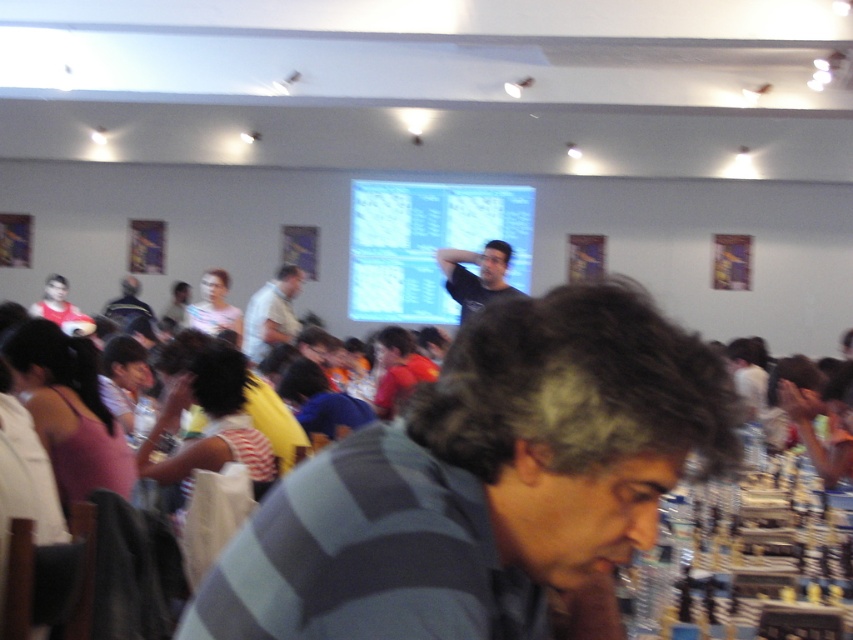
Measure the distance from gray striped shirt at center to light gray shirt at center.

The distance of gray striped shirt at center from light gray shirt at center is 20.62 feet.

Does gray striped shirt at center come in front of light gray shirt at center?

Yes.

I want to click on gray striped shirt at center, so click(485, 481).

Is gray striped shirt at center wider than black matte shirt at center?

Yes, gray striped shirt at center is wider than black matte shirt at center.

Is gray striped shirt at center above black matte shirt at center?

No, gray striped shirt at center is not above black matte shirt at center.

You are a GUI agent. You are given a task and a screenshot of the screen. Output one action in this format:
    pyautogui.click(x=<x>, y=<y>)
    Task: Click on the gray striped shirt at center
    The height and width of the screenshot is (640, 853).
    Given the screenshot: What is the action you would take?
    pyautogui.click(x=485, y=481)

Does point (677, 333) come closer to viewer compared to point (379, 182)?

Yes, point (677, 333) is closer to viewer.

Measure the distance between gray striped shirt at center and camera.

gray striped shirt at center and camera are 68.06 centimeters apart.

Who is more forward, [444,588] or [450,227]?

Point [444,588] is more forward.

Where is `gray striped shirt at center`? gray striped shirt at center is located at coordinates (485, 481).